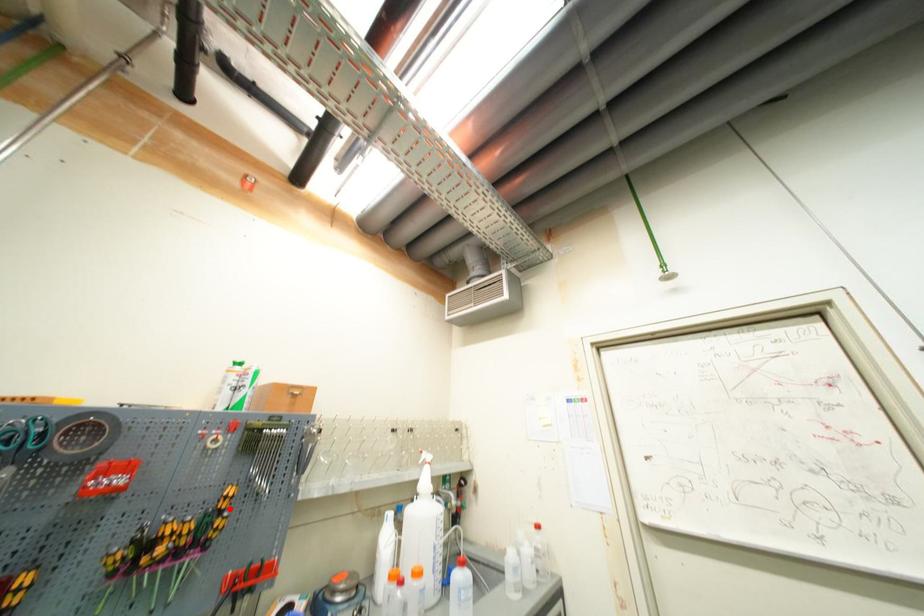
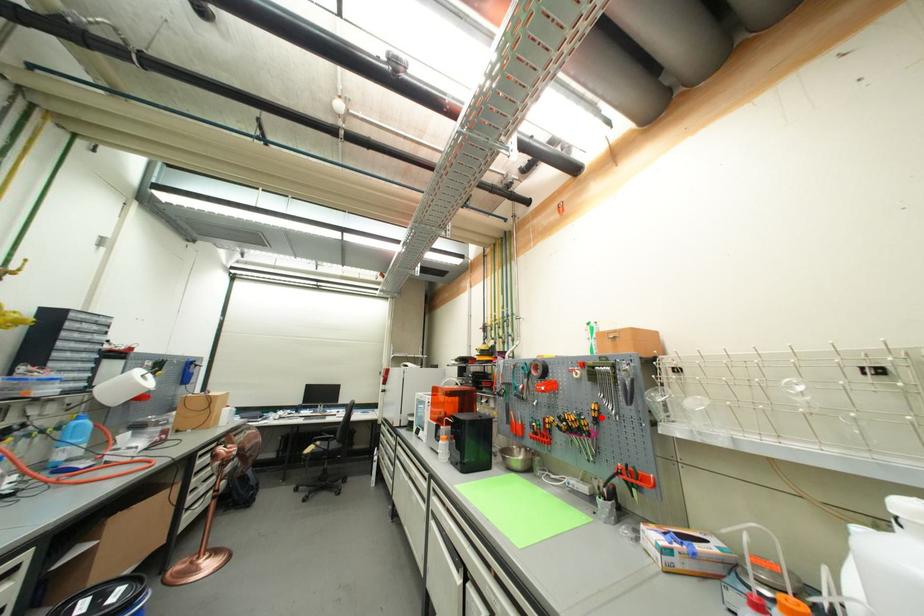
I am providing you with two images of the same scene from different viewpoints. A red point is marked on the first image and another point is marked on the second image. Is the red point in image1 aligned with the point shown in image2?

Yes